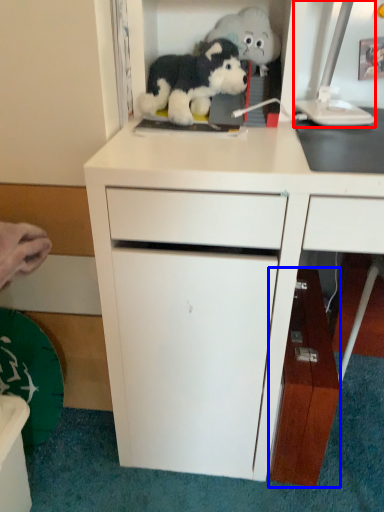
Question: Which object is closer to the camera taking this photo, computer monitor (highlighted by a red box) or cabinetry (highlighted by a blue box)?

Choices:
 (A) computer monitor
 (B) cabinetry

Answer: (A)